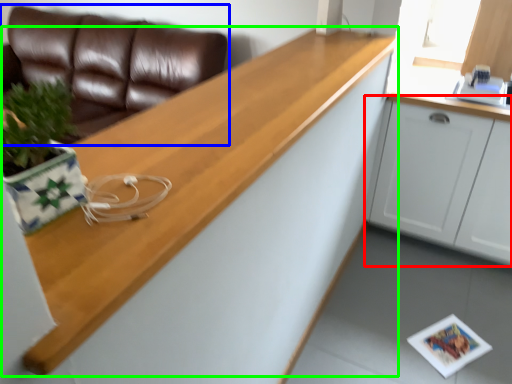
Question: Which object is positioned closest to cabinetry (highlighted by a red box)? Select from studio couch (highlighted by a blue box) and countertop (highlighted by a green box).

Choices:
 (A) studio couch
 (B) countertop

Answer: (B)